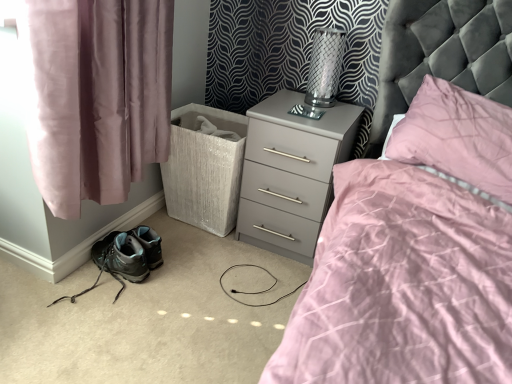
Question: Is metallic mesh table lamp at upper right at the back of white textured laundry basket at lower left?

Choices:
 (A) yes
 (B) no

Answer: (B)

Question: Can you confirm if white textured laundry basket at lower left is positioned to the right of metallic mesh table lamp at upper right?

Choices:
 (A) no
 (B) yes

Answer: (A)

Question: Is white textured laundry basket at lower left completely or partially outside of metallic mesh table lamp at upper right?

Choices:
 (A) no
 (B) yes

Answer: (B)

Question: Considering the relative positions of white textured laundry basket at lower left and metallic mesh table lamp at upper right in the image provided, is white textured laundry basket at lower left in front of metallic mesh table lamp at upper right?

Choices:
 (A) yes
 (B) no

Answer: (B)

Question: From the image's perspective, is white textured laundry basket at lower left beneath metallic mesh table lamp at upper right?

Choices:
 (A) yes
 (B) no

Answer: (A)

Question: Considering the relative sizes of white textured laundry basket at lower left and metallic mesh table lamp at upper right in the image provided, is white textured laundry basket at lower left thinner than metallic mesh table lamp at upper right?

Choices:
 (A) yes
 (B) no

Answer: (B)

Question: Considering the relative sizes of pink satin pillow at upper right and white textured laundry basket at lower left in the image provided, is pink satin pillow at upper right smaller than white textured laundry basket at lower left?

Choices:
 (A) yes
 (B) no

Answer: (B)

Question: Is pink satin pillow at upper right turned away from white textured laundry basket at lower left?

Choices:
 (A) yes
 (B) no

Answer: (B)

Question: Is pink satin pillow at upper right further to camera compared to white textured laundry basket at lower left?

Choices:
 (A) yes
 (B) no

Answer: (B)

Question: Could you tell me if pink satin pillow at upper right is turned towards white textured laundry basket at lower left?

Choices:
 (A) no
 (B) yes

Answer: (A)

Question: From the image's perspective, does pink satin pillow at upper right appear lower than white textured laundry basket at lower left?

Choices:
 (A) no
 (B) yes

Answer: (A)

Question: Does pink satin pillow at upper right have a larger size compared to white textured laundry basket at lower left?

Choices:
 (A) no
 (B) yes

Answer: (B)

Question: Does matte gray hiking boots at lower left have a larger size compared to gray matte nightstand at center?

Choices:
 (A) yes
 (B) no

Answer: (B)